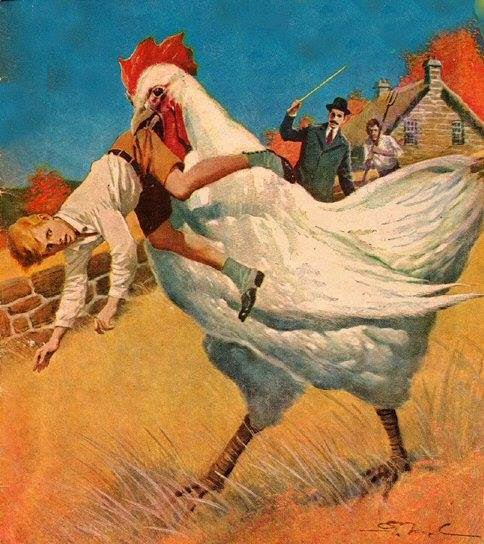
Where is `windows`? The width and height of the screenshot is (484, 544). windows is located at coordinates (408, 127), (456, 126).